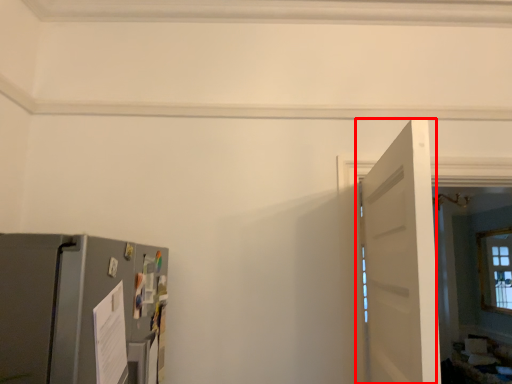
Question: From the image's perspective, what is the correct spatial relationship of door (annotated by the red box) in relation to appliance?

Choices:
 (A) above
 (B) below

Answer: (A)